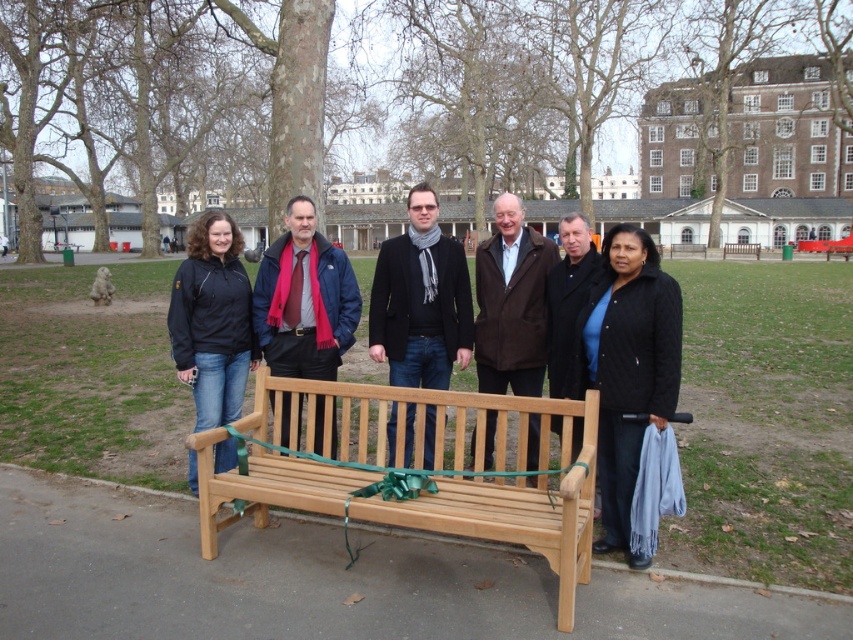
You are a photographer trying to capture a group photo of the people at the park. The camera you are using has a minimum focus distance of 1.2 meters. Can you take a photo of both the black quilted jacket at center and the brown leather jacket at center without moving either of them?

The black quilted jacket at center and brown leather jacket at center are 1.17 meters apart, which is less than the camera minimum focus distance of 1.2 meters. Therefore, you cannot take the photo without moving them.